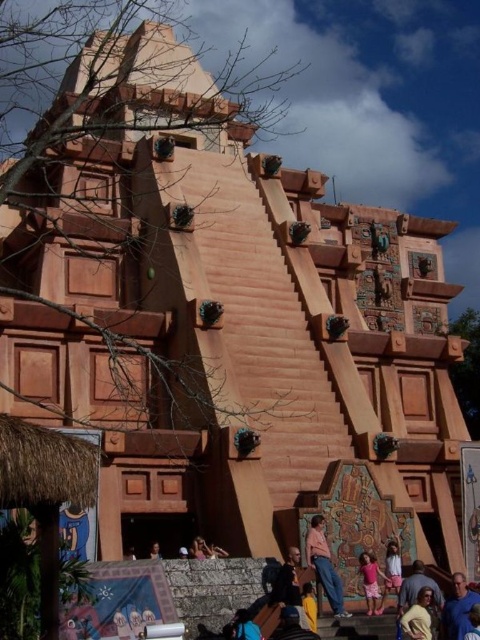
Does pink cotton dress at lower center have a greater width compared to light brown wooden bench at lower center?

Yes.

What do you see at coordinates (371, 582) in the screenshot? I see `pink cotton dress at lower center` at bounding box center [371, 582].

This screenshot has height=640, width=480. Identify the location of pink cotton dress at lower center. (371, 582).

Which of these two, blue fabric shirt at center or pink cotton dress at lower center, stands taller?

pink cotton dress at lower center

Between blue fabric shirt at center and pink cotton dress at lower center, which one appears on the right side from the viewer's perspective?

Positioned to the right is blue fabric shirt at center.

Which is behind, point (463, 604) or point (384, 579)?

The point (384, 579) is behind.

The width and height of the screenshot is (480, 640). Find the location of `blue fabric shirt at center`. blue fabric shirt at center is located at coordinates (457, 609).

Who is shorter, dark blue jeans at lower center or light brown wooden bench at lower center?

light brown wooden bench at lower center

Measure the distance between dark blue jeans at lower center and light brown wooden bench at lower center.

dark blue jeans at lower center is 11.23 meters from light brown wooden bench at lower center.

Which is behind, point (278, 604) or point (152, 552)?

Point (152, 552)

The image size is (480, 640). Identify the location of dark blue jeans at lower center. (289, 586).